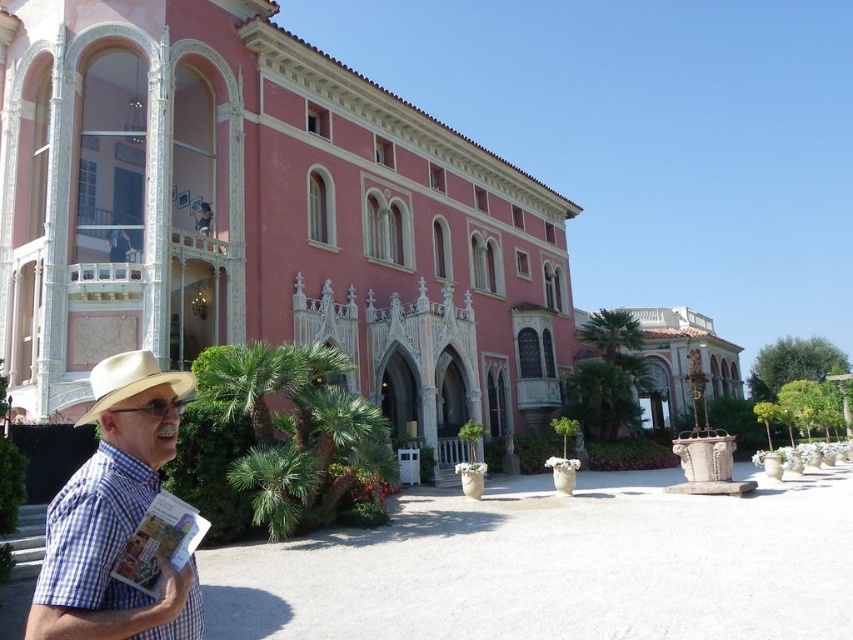
You are a photographer positioned to the left of the man in the scene. You want to capture a closeup of the blue checkered shirt at lower left and the white felt cowboy hat at lower left in your shot. Which object should appear on the right side of your photo?

The blue checkered shirt at lower left should appear on the right side of your photo because it is positioned to the right of the white felt cowboy hat at lower left.